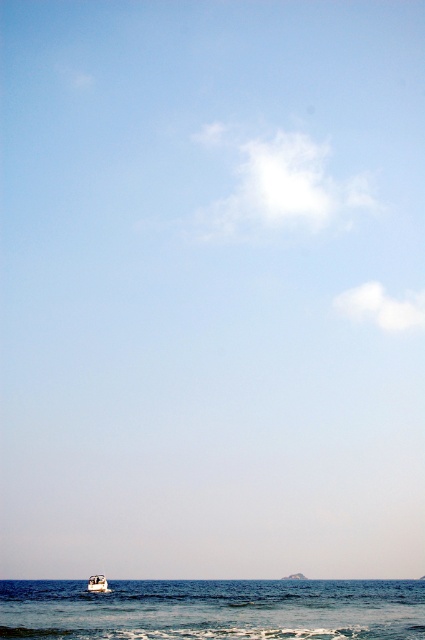
Question: Which point is closer to the camera?

Choices:
 (A) white glossy boat at lower center
 (B) blue water at lower center

Answer: (B)

Question: Which point is farther to the camera?

Choices:
 (A) (90, 584)
 (B) (169, 612)

Answer: (A)

Question: Considering the relative positions of blue water at lower center and white glossy boat at lower center in the image provided, where is blue water at lower center located with respect to white glossy boat at lower center?

Choices:
 (A) above
 (B) below

Answer: (B)

Question: Is blue water at lower center smaller than white glossy boat at lower center?

Choices:
 (A) no
 (B) yes

Answer: (A)

Question: Does blue water at lower center appear over white glossy boat at lower center?

Choices:
 (A) no
 (B) yes

Answer: (A)

Question: Among these points, which one is farthest from the camera?

Choices:
 (A) (416, 582)
 (B) (93, 592)

Answer: (A)